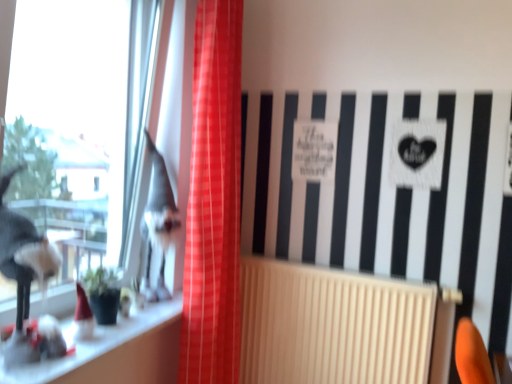
Question: Is red plaid curtain at center to the left of beige ribbed radiator at center from the viewer's perspective?

Choices:
 (A) no
 (B) yes

Answer: (B)

Question: Can you confirm if red plaid curtain at center is shorter than beige ribbed radiator at center?

Choices:
 (A) yes
 (B) no

Answer: (B)

Question: Is red plaid curtain at center touching beige ribbed radiator at center?

Choices:
 (A) yes
 (B) no

Answer: (B)

Question: Considering the relative sizes of red plaid curtain at center and beige ribbed radiator at center in the image provided, is red plaid curtain at center wider than beige ribbed radiator at center?

Choices:
 (A) yes
 (B) no

Answer: (A)

Question: Is beige ribbed radiator at center inside red plaid curtain at center?

Choices:
 (A) yes
 (B) no

Answer: (B)

Question: Is the depth of red plaid curtain at center greater than that of beige ribbed radiator at center?

Choices:
 (A) yes
 (B) no

Answer: (B)

Question: Is the depth of transparent glass window at left greater than that of beige ribbed radiator at center?

Choices:
 (A) yes
 (B) no

Answer: (B)

Question: Is transparent glass window at left positioned beyond the bounds of beige ribbed radiator at center?

Choices:
 (A) yes
 (B) no

Answer: (A)

Question: Is transparent glass window at left at the left side of beige ribbed radiator at center?

Choices:
 (A) no
 (B) yes

Answer: (B)

Question: Would you consider transparent glass window at left to be distant from beige ribbed radiator at center?

Choices:
 (A) yes
 (B) no

Answer: (A)

Question: Does transparent glass window at left turn towards beige ribbed radiator at center?

Choices:
 (A) no
 (B) yes

Answer: (A)

Question: Is transparent glass window at left in front of beige ribbed radiator at center?

Choices:
 (A) no
 (B) yes

Answer: (B)

Question: Considering the relative sizes of beige ribbed radiator at center and white glossy window sill at lower left in the image provided, is beige ribbed radiator at center thinner than white glossy window sill at lower left?

Choices:
 (A) yes
 (B) no

Answer: (A)